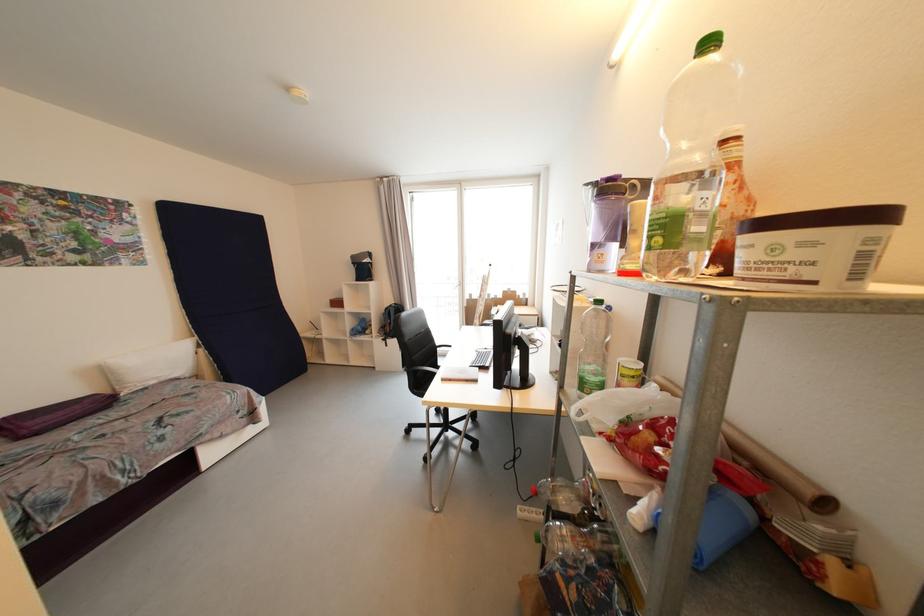
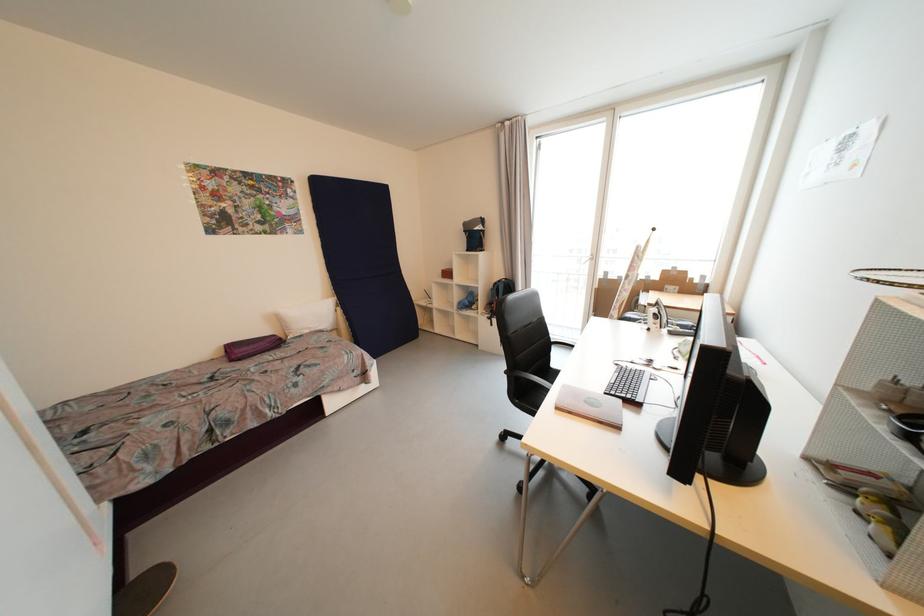
The point at (108, 374) is marked in the first image. Where is the corresponding point in the second image?

(283, 321)